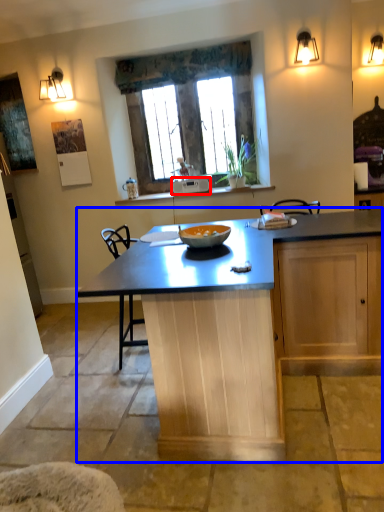
Question: Which point is further to the camera, appliance (highlighted by a red box) or kitchen & dining room table (highlighted by a blue box)?

Choices:
 (A) appliance
 (B) kitchen & dining room table

Answer: (A)